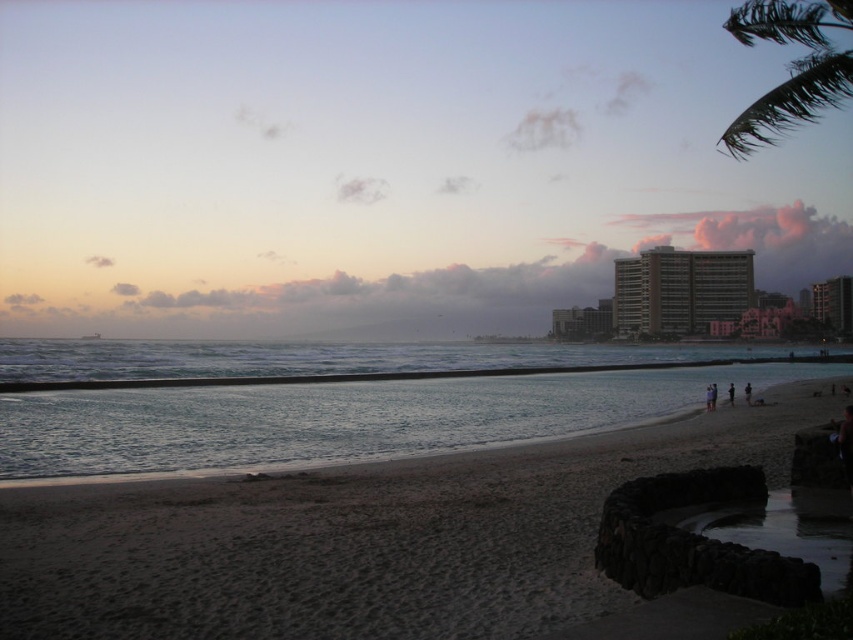
Which is below, clear blue water at center or brown concrete building at center-right?

clear blue water at center is below.

This screenshot has width=853, height=640. I want to click on clear blue water at center, so click(340, 417).

What do you see at coordinates (340, 417) in the screenshot?
I see `clear blue water at center` at bounding box center [340, 417].

This screenshot has width=853, height=640. What are the coordinates of `clear blue water at center` in the screenshot? It's located at [x=340, y=417].

Who is lower down, clear blue water at center or dark skin textured person at lower right?

clear blue water at center is lower down.

Can you confirm if clear blue water at center is smaller than dark skin textured person at lower right?

No.

Is point (325, 406) more distant than point (730, 404)?

No, (325, 406) is closer to viewer.

I want to click on clear blue water at center, so click(x=340, y=417).

Between green leafy palm tree at upper right and dark blue fabric at lower right, which one appears on the right side from the viewer's perspective?

green leafy palm tree at upper right

Does point (782, 124) come closer to viewer compared to point (747, 403)?

Yes, it is in front of point (747, 403).

This screenshot has height=640, width=853. I want to click on green leafy palm tree at upper right, so click(x=790, y=67).